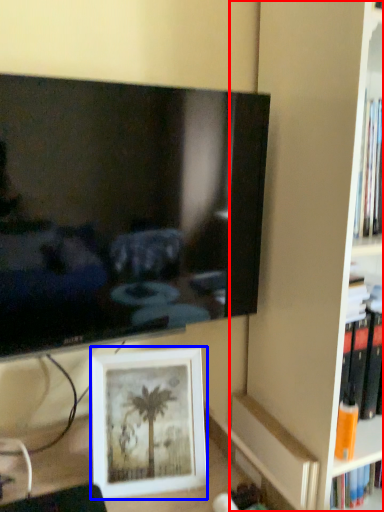
Question: Which point is further to the camera, bookshelf (highlighted by a red box) or picture frame (highlighted by a blue box)?

Choices:
 (A) bookshelf
 (B) picture frame

Answer: (B)